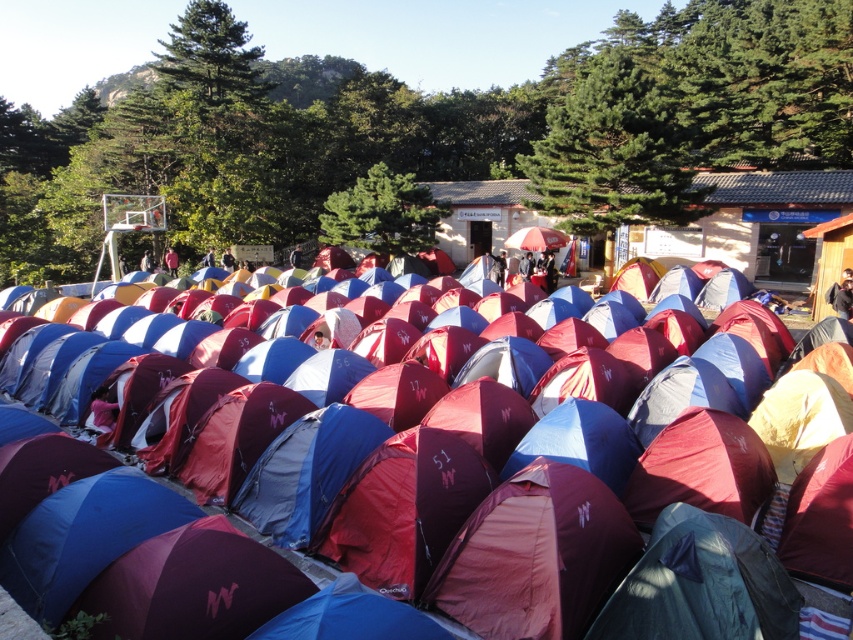
Can you confirm if blue fabric tent at center is positioned to the right of red fabric umbrella at center?

In fact, blue fabric tent at center is to the left of red fabric umbrella at center.

Find the location of `blue fabric tent at center`. blue fabric tent at center is located at coordinates tap(688, 484).